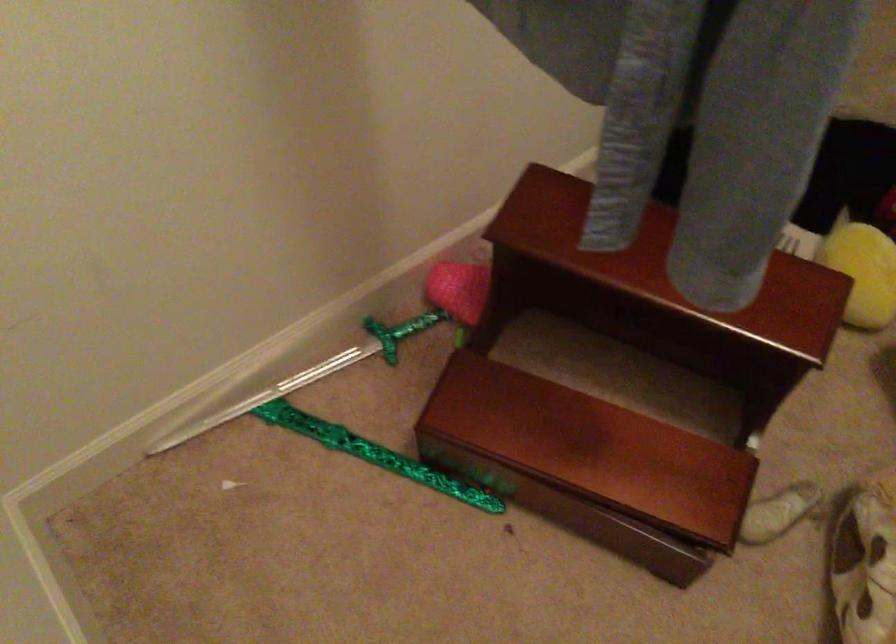
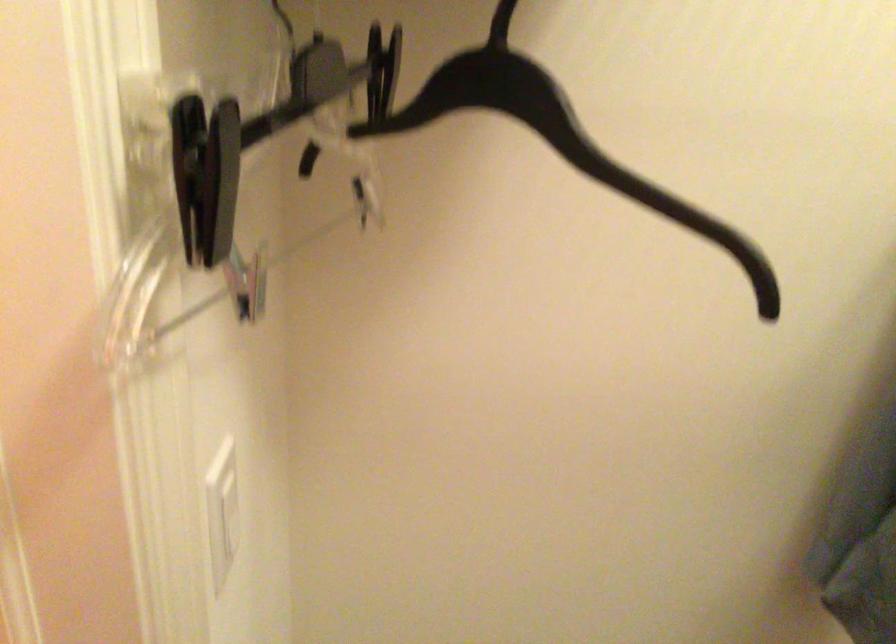
How did the camera likely rotate?

The camera's rotation is toward left-up.